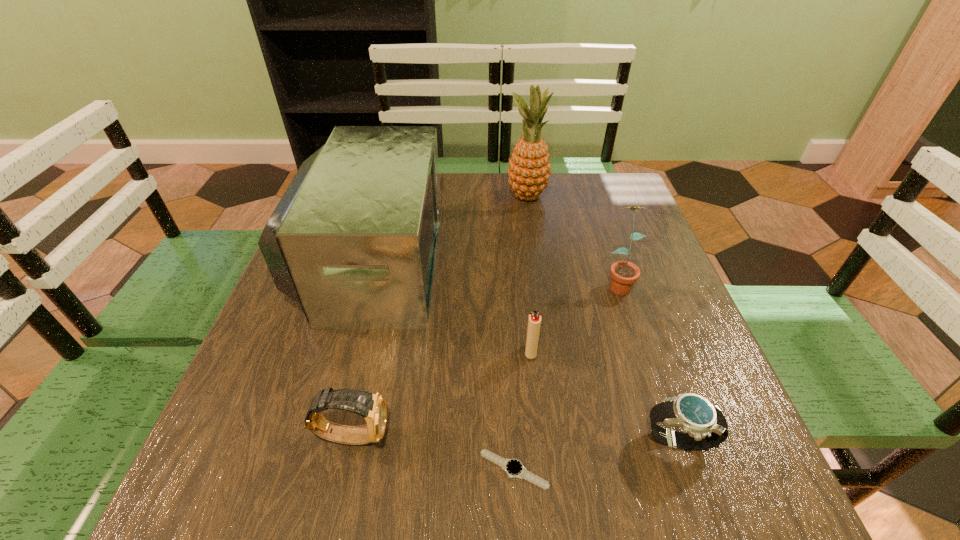
Identify the location of free location that satisfies the following two spatial constraints: 1. on the back side of the fourth farthest object; 2. on the front-facing side of the microwave oven. This screenshot has width=960, height=540. (521, 260).